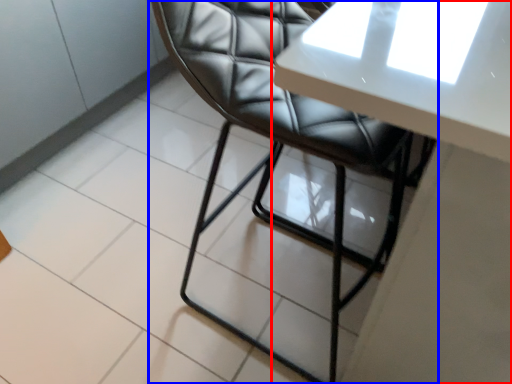
Question: Which point is closer to the camera, table (highlighted by a red box) or chair (highlighted by a blue box)?

Choices:
 (A) table
 (B) chair

Answer: (A)